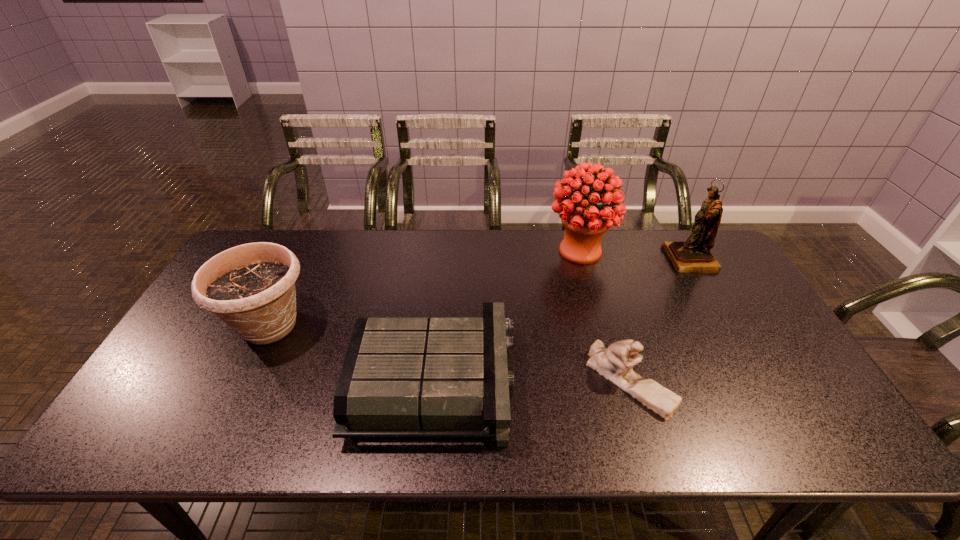
You are a GUI agent. You are given a task and a screenshot of the screen. Output one action in this format:
    pyautogui.click(x=<x>, y=<y>)
    Task: Click on the blank space that satisfies the following two spatial constraints: 1. on the back side of the bouquet; 2. on the right side of the third tallest object
    The height and width of the screenshot is (540, 960).
    Given the screenshot: What is the action you would take?
    (x=305, y=251)